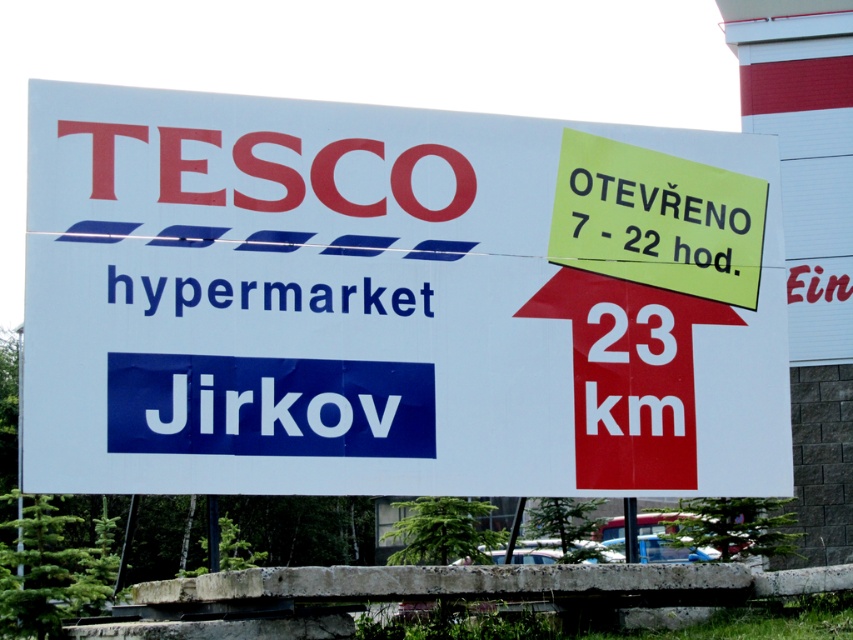
Question: Is white paper sign at center wider than yellow paper sign at upper right?

Choices:
 (A) no
 (B) yes

Answer: (B)

Question: Does white paper sign at center appear on the right side of yellow paper sign at upper right?

Choices:
 (A) yes
 (B) no

Answer: (B)

Question: Can you confirm if white paper sign at center is wider than yellow paper sign at upper right?

Choices:
 (A) no
 (B) yes

Answer: (B)

Question: Among these objects, which one is nearest to the camera?

Choices:
 (A) white paper sign at center
 (B) yellow paper sign at upper right

Answer: (A)

Question: Among these points, which one is nearest to the camera?

Choices:
 (A) (759, 192)
 (B) (181, 124)

Answer: (B)